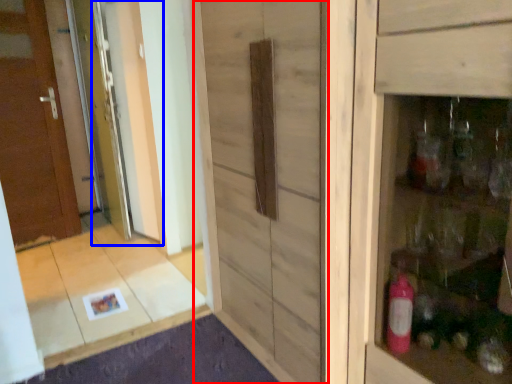
Question: Which object is further to the camera taking this photo, barn door (highlighted by a red box) or screen door (highlighted by a blue box)?

Choices:
 (A) barn door
 (B) screen door

Answer: (B)